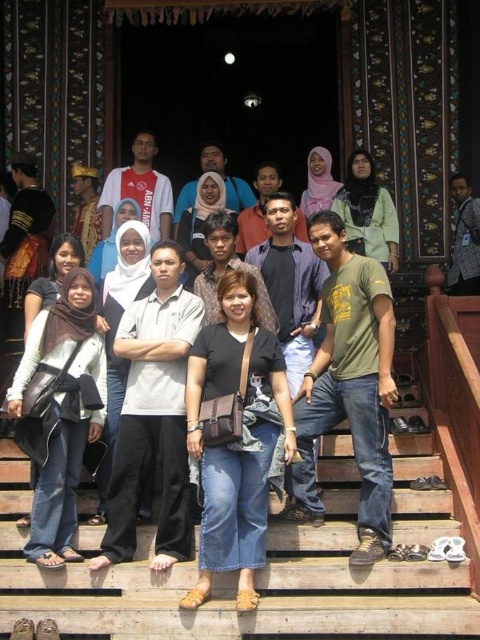
Question: Can you confirm if wooden stairs at center is wider than matte black shirt at center?

Choices:
 (A) yes
 (B) no

Answer: (A)

Question: In this image, where is green matte t-shirt at center located relative to matte black shirt at center?

Choices:
 (A) right
 (B) left

Answer: (A)

Question: Is wooden stairs at center positioned behind green matte t-shirt at center?

Choices:
 (A) yes
 (B) no

Answer: (B)

Question: Which is farther from the green matte t-shirt at center?

Choices:
 (A) wooden stairs at center
 (B) matte black shirt at center

Answer: (A)

Question: Which object is positioned closest to the matte black shirt at center?

Choices:
 (A) green matte t-shirt at center
 (B) wooden stairs at center

Answer: (A)

Question: Estimate the real-world distances between objects in this image. Which object is farther from the wooden stairs at center?

Choices:
 (A) green matte t-shirt at center
 (B) matte black shirt at center

Answer: (A)